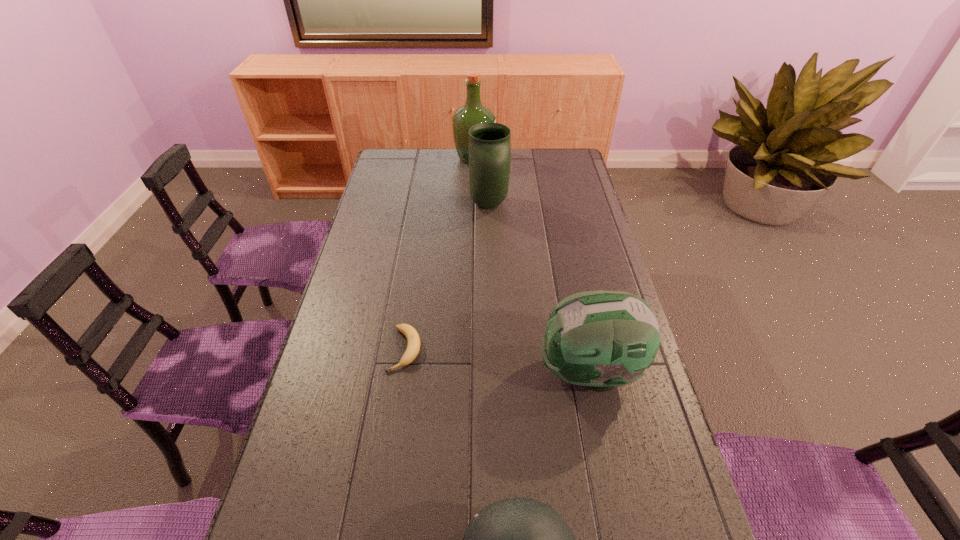
Find the location of a particular element. The width and height of the screenshot is (960, 540). free point between the fourth nearest object and the shortest object is located at coordinates (447, 277).

Identify the location of free space that is in between the farthest object and the shortest object. The height and width of the screenshot is (540, 960). coord(440,254).

I want to click on free point between the farther football helmet and the leftmost object, so click(497, 361).

Choose which object is the nearest neighbor to the farthest object. Please provide its 2D coordinates. Your answer should be formatted as a tuple, i.e. [(x, y)], where the tuple contains the x and y coordinates of a point satisfying the conditions above.

[(489, 143)]

You are a GUI agent. You are given a task and a screenshot of the screen. Output one action in this format:
    pyautogui.click(x=<x>, y=<y>)
    Task: Click on the fourth closest object to the vase
    This screenshot has width=960, height=540.
    Given the screenshot: What is the action you would take?
    pyautogui.click(x=517, y=539)

Where is `blank space that satisfies the following two spatial constraints: 1. on the front-facing side of the tallest object; 2. at the stem of the leftmost object`? blank space that satisfies the following two spatial constraints: 1. on the front-facing side of the tallest object; 2. at the stem of the leftmost object is located at coordinates (470, 349).

Image resolution: width=960 pixels, height=540 pixels. I want to click on free point that satisfies the following two spatial constraints: 1. on the front-facing side of the farthest object; 2. at the stem of the leftmost object, so click(470, 349).

Find the location of `free location that satisfies the following two spatial constraints: 1. on the front-facing side of the tallest object; 2. at the stem of the leftmost object`. free location that satisfies the following two spatial constraints: 1. on the front-facing side of the tallest object; 2. at the stem of the leftmost object is located at coordinates (470, 349).